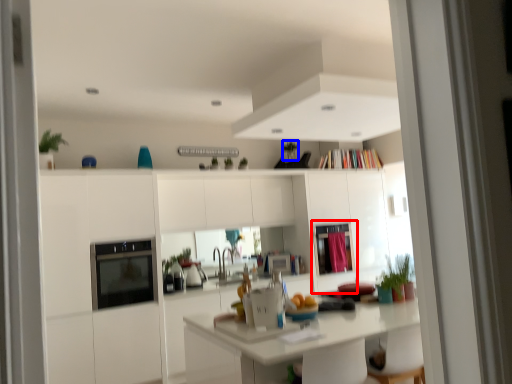
Question: Among these objects, which one is farthest to the camera, screen door (highlighted by a red box) or plant (highlighted by a blue box)?

Choices:
 (A) screen door
 (B) plant

Answer: (B)